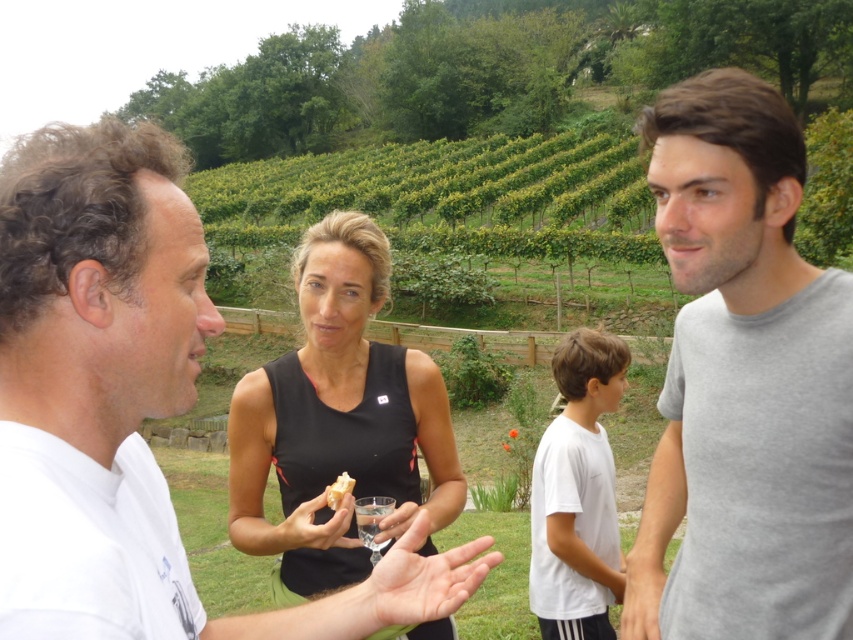
In the vineyard scene, there are a white cotton shirt at upper left and a white crumbly bread at center. Which object is higher up in the image?

The white cotton shirt at upper left is taller than the white crumbly bread at center, so the white cotton shirt at upper left is higher up in the image.

From the picture: You are a photographer trying to capture a closeup shot of the white crumbly bread at center. Since the white cotton shirt at upper left is blocking your view, can you estimate whether you can move the shirt out of the way without moving the bread?

The white cotton shirt at upper left is larger in size than white crumbly bread at center. Since the shirt is bigger, you can move it out of the way without disturbing the bread as long as you have enough space to maneuver around it.

You are a photographer trying to capture a closeup of the white crumbly bread at center without including the white cotton shirt at upper left in the frame. Given their relative sizes, is this possible?

The white cotton shirt at upper left is wider than the white crumbly bread at center, so it is possible to frame the shot to exclude the shirt by focusing on the narrower bread.